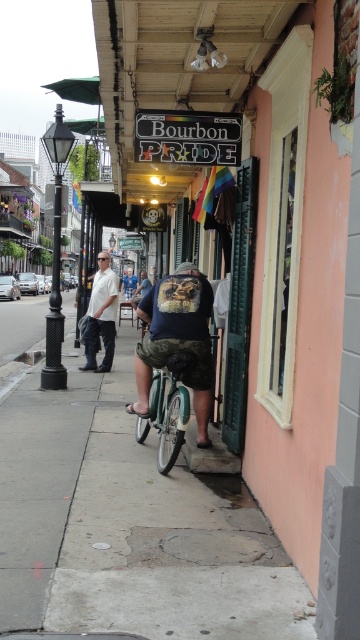
Question: Which object is the farthest from the dark blue denim shorts at center?

Choices:
 (A) denim shorts at center
 (B) concrete at center

Answer: (A)

Question: Can you confirm if dark blue denim shorts at center is positioned below denim pants at left?

Choices:
 (A) yes
 (B) no

Answer: (A)

Question: Does concrete at center appear on the left side of denim pants at left?

Choices:
 (A) no
 (B) yes

Answer: (A)

Question: Which object is positioned farthest from the dark blue denim shorts at center?

Choices:
 (A) concrete at center
 (B) denim pants at left
 (C) denim shorts at center

Answer: (C)

Question: Does concrete at center have a smaller size compared to dark blue denim shorts at center?

Choices:
 (A) yes
 (B) no

Answer: (B)

Question: Which is farther from the dark blue denim shorts at center?

Choices:
 (A) denim shorts at center
 (B) denim pants at left

Answer: (A)